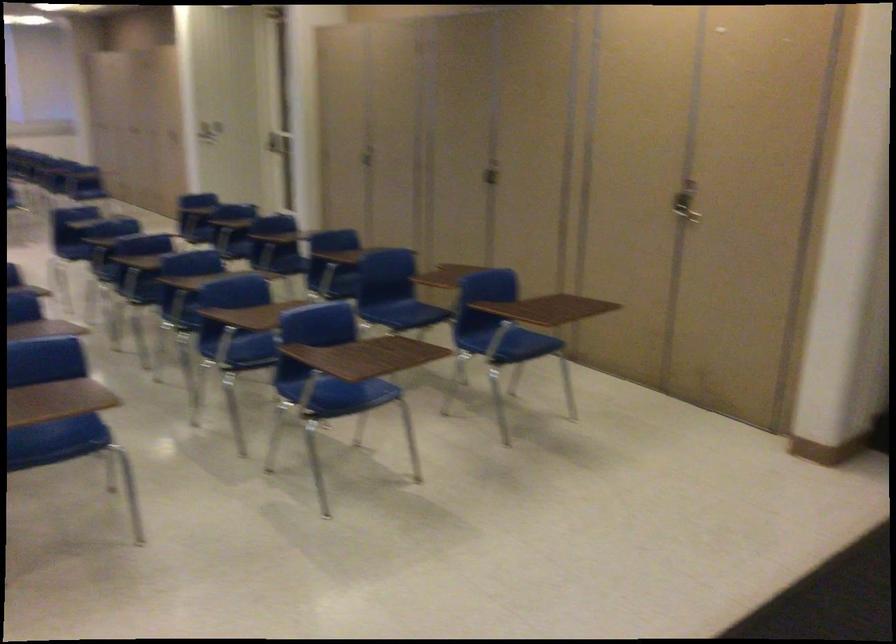
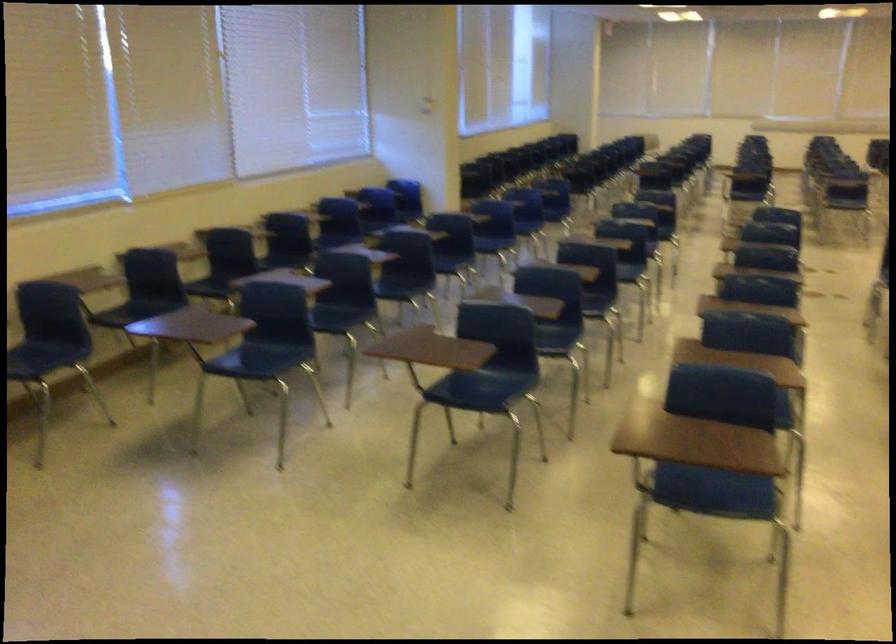
Question: The camera is either moving clockwise (left) or counter-clockwise (right) around the object. The first image is from the beginning of the video and the second image is from the end. Is the camera moving left or right when shooting the video?

Choices:
 (A) Left
 (B) Right

Answer: (B)